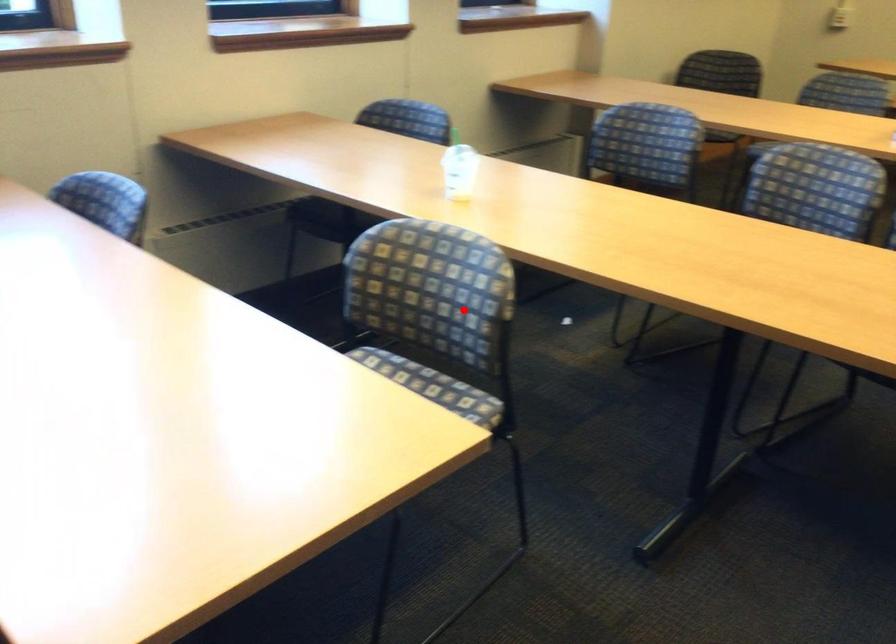
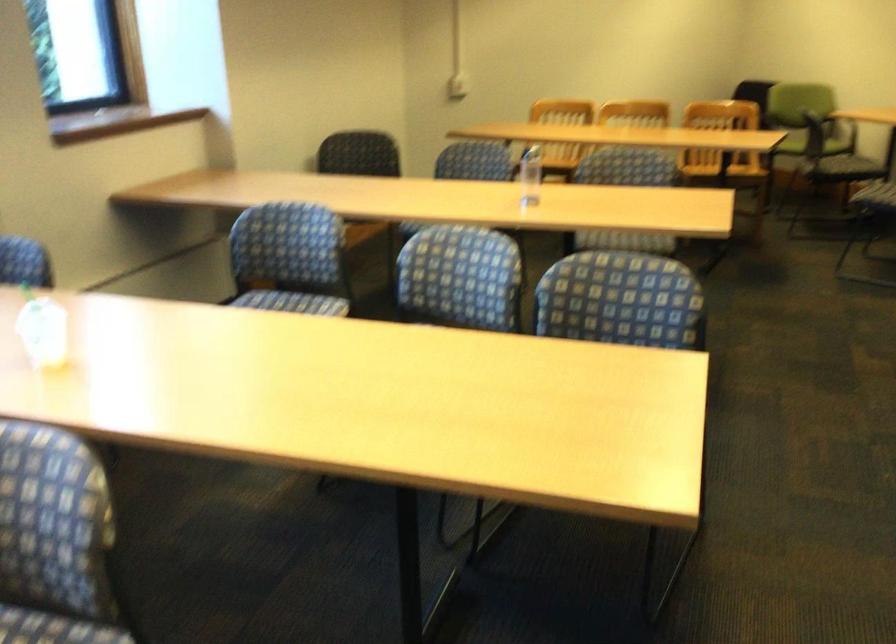
Where in the second image is the point corresponding to the highlighted location from the first image?

(54, 540)